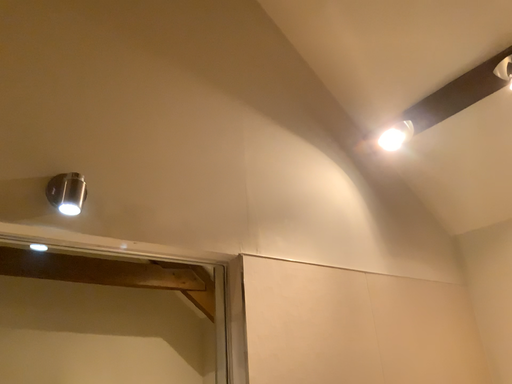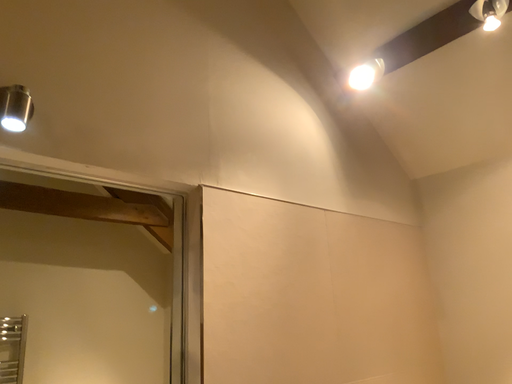
Question: Which way did the camera rotate in the video?

Choices:
 (A) rotated downward
 (B) rotated upward

Answer: (A)